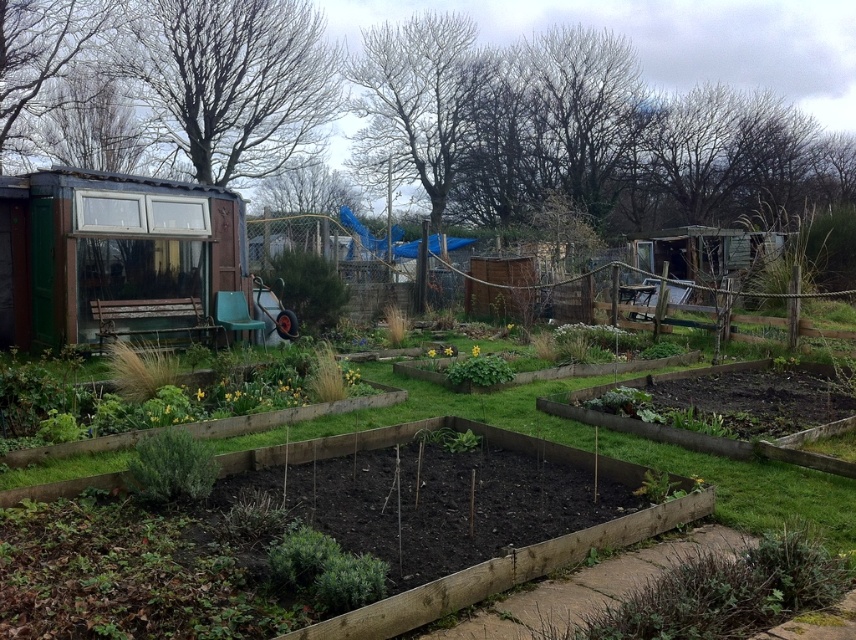
Between point (274, 456) and point (473, 372), which one is positioned behind?

Point (473, 372)

Can you confirm if brown wooden raised beds at center is taller than yellow matte flower bed at center?

No.

Identify the location of brown wooden raised beds at center. The image size is (856, 640). (321, 445).